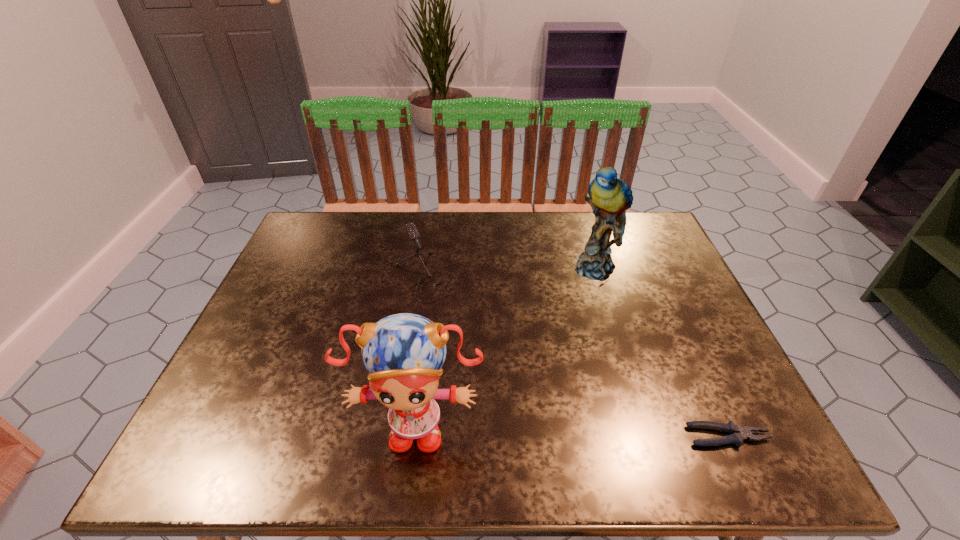
Find the location of `vacant area in the image that satisfies the following two spatial constraints: 1. on the front side of the pliers; 2. at the gripping part of the third object from left to right`. vacant area in the image that satisfies the following two spatial constraints: 1. on the front side of the pliers; 2. at the gripping part of the third object from left to right is located at coordinates (651, 436).

You are a GUI agent. You are given a task and a screenshot of the screen. Output one action in this format:
    pyautogui.click(x=<x>, y=<y>)
    Task: Click on the free location that satisfies the following two spatial constraints: 1. on the front side of the pliers; 2. at the gripping part of the parrot
    This screenshot has height=540, width=960.
    Given the screenshot: What is the action you would take?
    pyautogui.click(x=651, y=436)

I want to click on free spot that satisfies the following two spatial constraints: 1. on the face of the doll; 2. at the gripping part of the shortest object, so click(x=414, y=436).

Locate an element on the screen. The width and height of the screenshot is (960, 540). vacant region that satisfies the following two spatial constraints: 1. on the face of the rightmost object; 2. at the gripping part of the doll is located at coordinates (414, 436).

This screenshot has width=960, height=540. Identify the location of vacant space that satisfies the following two spatial constraints: 1. on the face of the third shortest object; 2. at the gripping part of the pliers. (414, 436).